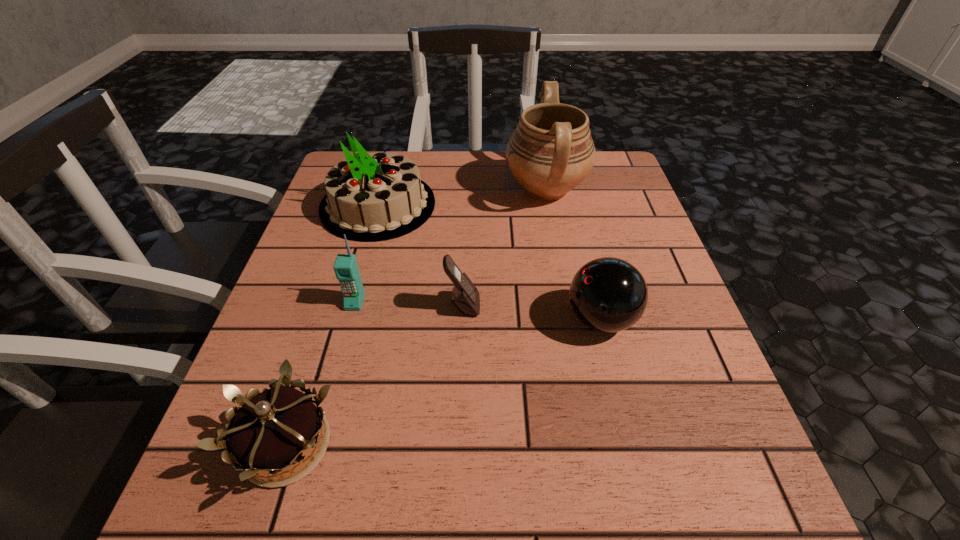
What are the coordinates of `urn` in the screenshot? It's located at (551, 151).

The width and height of the screenshot is (960, 540). I want to click on the fifth shortest object, so click(370, 197).

Where is `the taller cellular telephone`? This screenshot has width=960, height=540. the taller cellular telephone is located at coordinates (345, 267).

Locate an element on the screen. This screenshot has height=540, width=960. bowling ball is located at coordinates (608, 294).

At what (x,y) coordinates should I click in order to perform the action: click on the shorter cellular telephone. Please return your answer as a coordinate pair (x, y). The height and width of the screenshot is (540, 960). Looking at the image, I should click on (465, 296).

Find the location of a particular element. the fourth object from left to right is located at coordinates (465, 296).

Where is `crown`? This screenshot has height=540, width=960. crown is located at coordinates (274, 429).

Where is `free region located 0.160m on the front-facing side of the urn`? Image resolution: width=960 pixels, height=540 pixels. free region located 0.160m on the front-facing side of the urn is located at coordinates (442, 189).

The height and width of the screenshot is (540, 960). In order to click on free spot located on the front-facing side of the urn in this screenshot , I will do `click(418, 189)`.

In order to click on vacant space located 0.080m on the front-facing side of the urn in this screenshot , I will do pos(472,189).